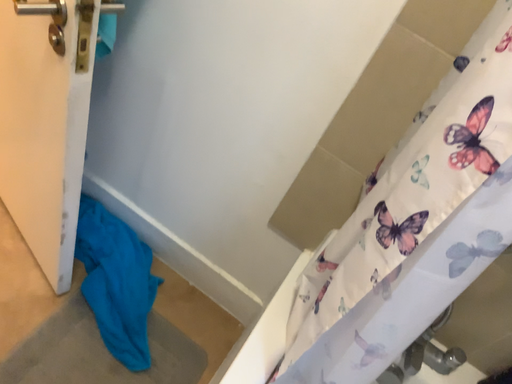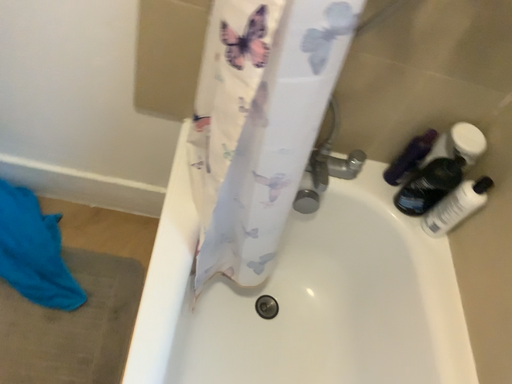
Question: Which way did the camera rotate in the video?

Choices:
 (A) rotated right
 (B) rotated left

Answer: (A)